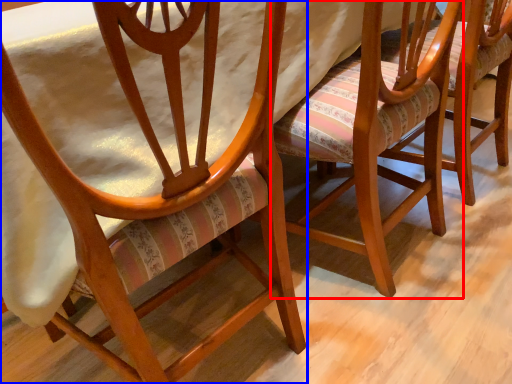
Question: Which object appears closest to the camera in this image, chair (highlighted by a red box) or chair (highlighted by a blue box)?

Choices:
 (A) chair
 (B) chair

Answer: (B)